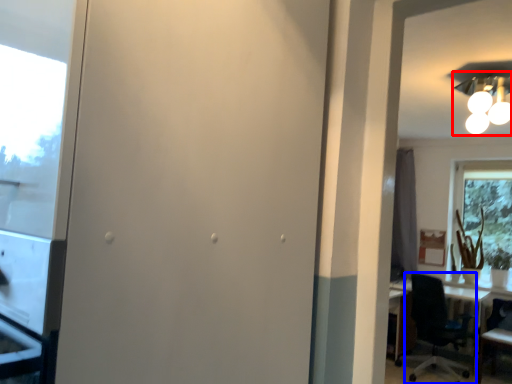
Question: Which object is closer to the camera taking this photo, light fixture (highlighted by a red box) or chair (highlighted by a blue box)?

Choices:
 (A) light fixture
 (B) chair

Answer: (A)